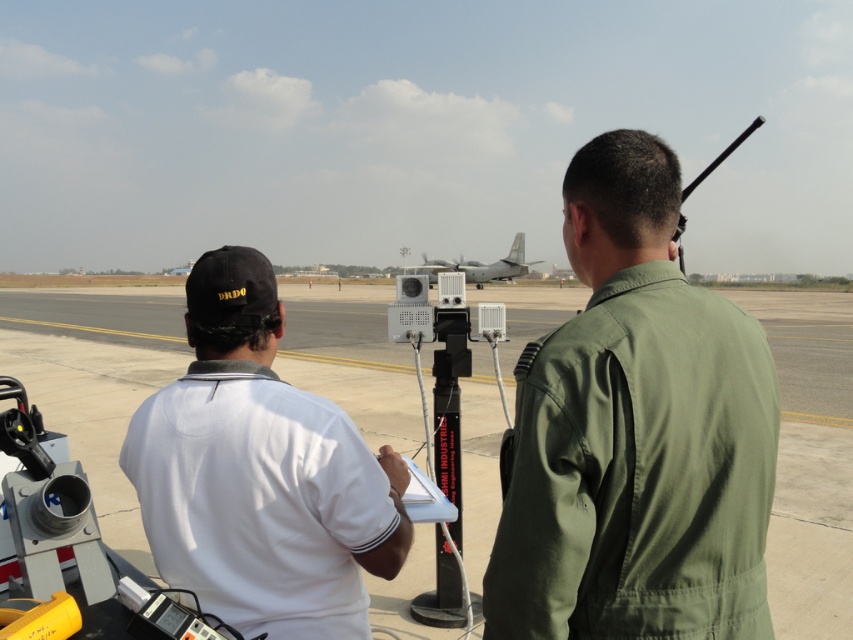
Question: Is white matte shirt at left to the left of gray matte airplane at center from the viewer's perspective?

Choices:
 (A) yes
 (B) no

Answer: (A)

Question: Which of the following is the closest to the observer?

Choices:
 (A) (207, 582)
 (B) (514, 262)

Answer: (A)

Question: Can you confirm if smooth concrete tarmac at center is positioned to the left of gray matte airplane at center?

Choices:
 (A) yes
 (B) no

Answer: (B)

Question: Which object appears farthest from the camera in this image?

Choices:
 (A) white matte shirt at left
 (B) green fabric uniform at center
 (C) smooth concrete tarmac at center

Answer: (C)

Question: Is smooth concrete tarmac at center bigger than white matte shirt at left?

Choices:
 (A) yes
 (B) no

Answer: (A)

Question: Which of these objects is positioned closest to the gray matte airplane at center?

Choices:
 (A) white matte shirt at left
 (B) green fabric uniform at center

Answer: (B)